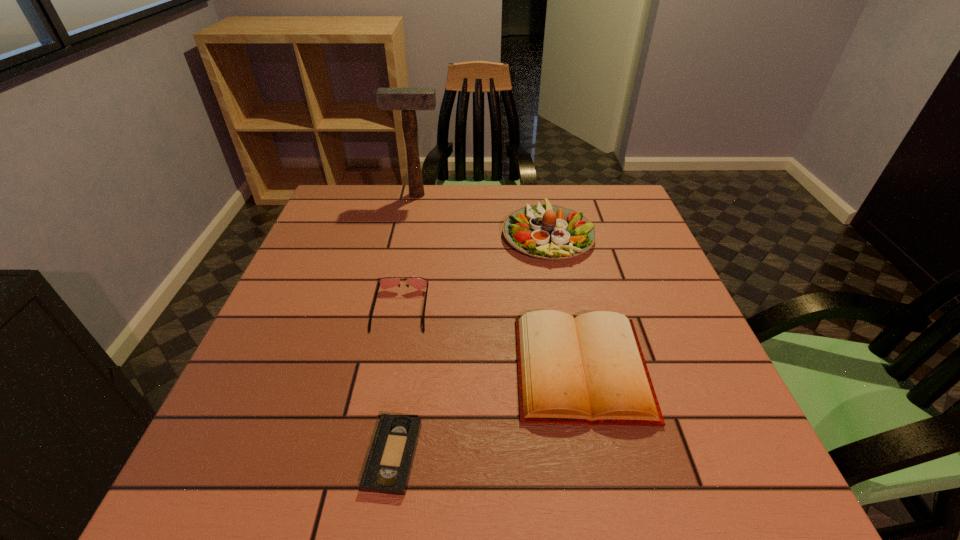
This screenshot has width=960, height=540. I want to click on free space that is in between the sunglasses and the second tallest object, so click(x=474, y=272).

At what (x,y) coordinates should I click in order to perform the action: click on free space between the sunglasses and the tallest object. Please return your answer as a coordinate pair (x, y). Looking at the image, I should click on (409, 252).

Find the location of `unoccupied position between the Bible and the salad plate`. unoccupied position between the Bible and the salad plate is located at coordinates (564, 301).

Image resolution: width=960 pixels, height=540 pixels. Identify the location of object identified as the fourth closest to the fourth shortest object. (389, 463).

Where is `object that is the fourth closest to the Bible`? object that is the fourth closest to the Bible is located at coordinates (408, 100).

Where is `free point that satisfies the following two spatial constraints: 1. on the bridge of the videotape; 2. on the right side of the sunglasses`? free point that satisfies the following two spatial constraints: 1. on the bridge of the videotape; 2. on the right side of the sunglasses is located at coordinates (373, 455).